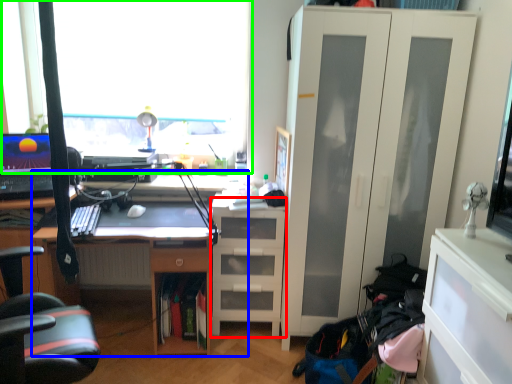
Question: Which object is positioned farthest from shelf (highlighted by a red box)? Select from desk (highlighted by a blue box) and window (highlighted by a green box).

Choices:
 (A) desk
 (B) window

Answer: (B)